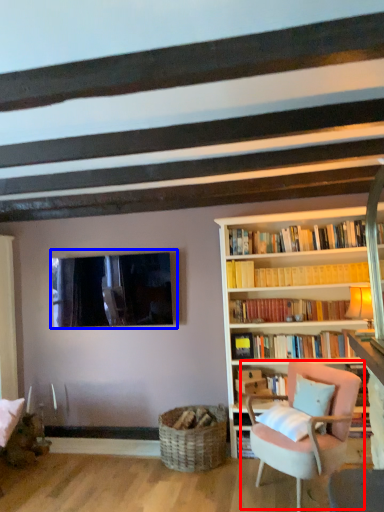
Question: Among these objects, which one is farthest to the camera, chair (highlighted by a red box) or window (highlighted by a blue box)?

Choices:
 (A) chair
 (B) window

Answer: (B)